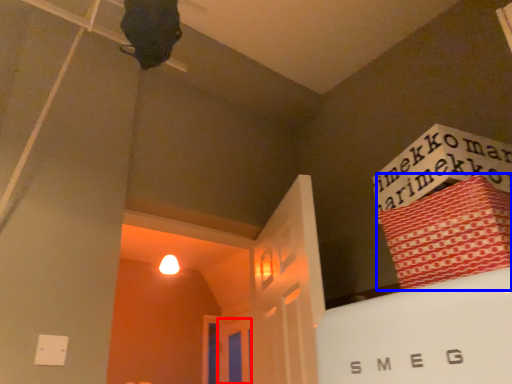
Question: Which object is closer to the camera taking this photo, door (highlighted by a red box) or bundle (highlighted by a blue box)?

Choices:
 (A) door
 (B) bundle

Answer: (B)